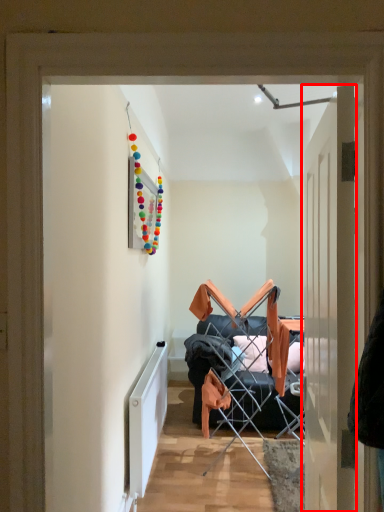
Question: Considering the relative positions of door (annotated by the red box) and radiator in the image provided, where is door (annotated by the red box) located with respect to the staircase?

Choices:
 (A) right
 (B) left

Answer: (A)